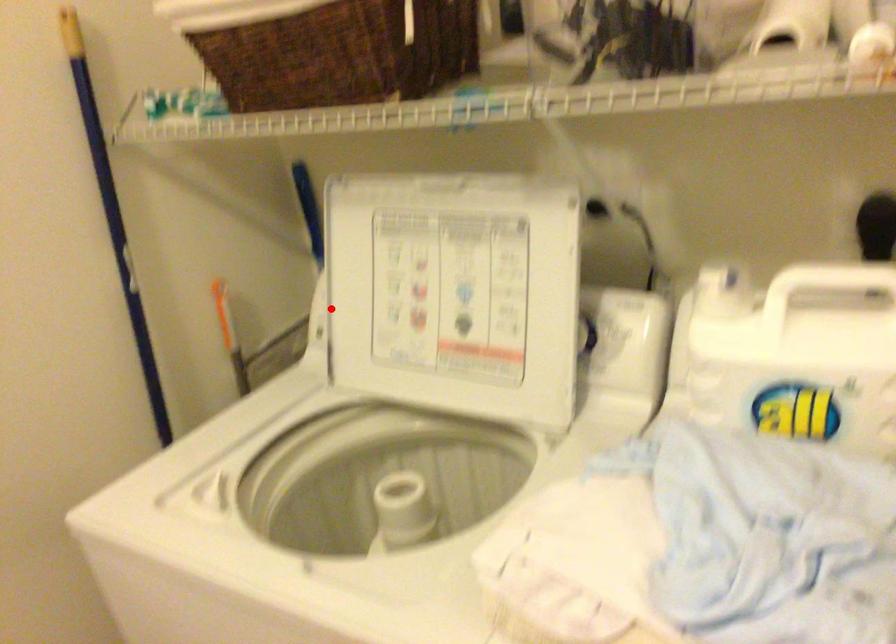
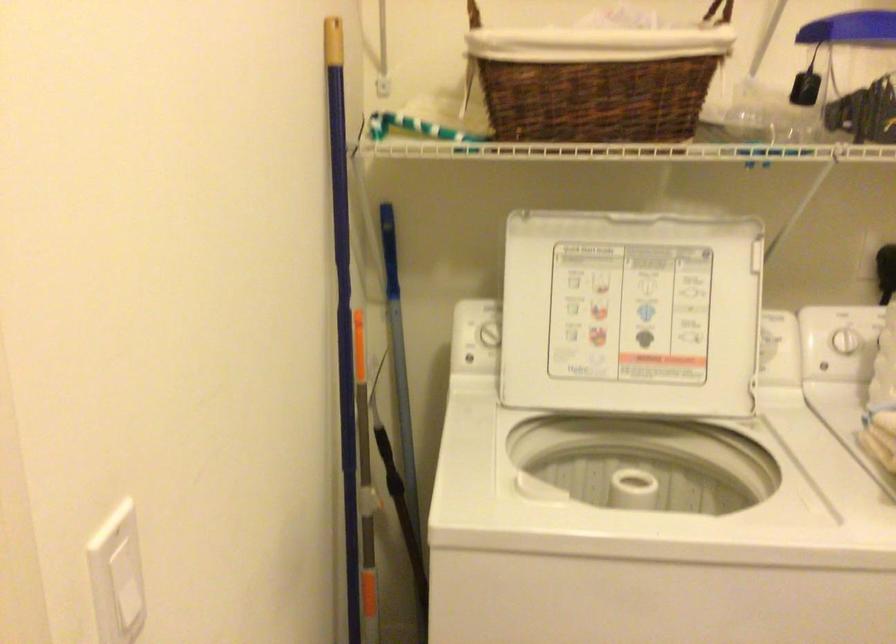
Question: I am providing you with two images of the same scene from different viewpoints. In image1, a red point is highlighted. Considering the same 3D point in image2, which of the following is correct?

Choices:
 (A) It is closer
 (B) It is farther

Answer: (B)